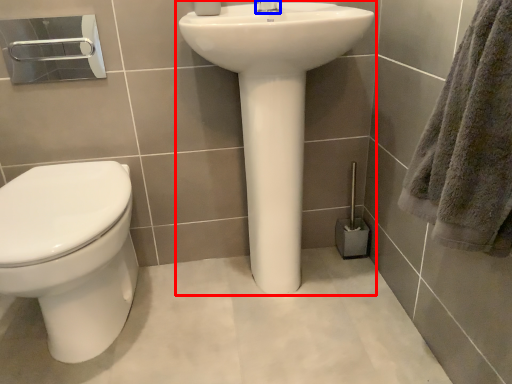
Question: Which object appears closest to the camera in this image, sink (highlighted by a red box) or tap (highlighted by a blue box)?

Choices:
 (A) sink
 (B) tap

Answer: (A)